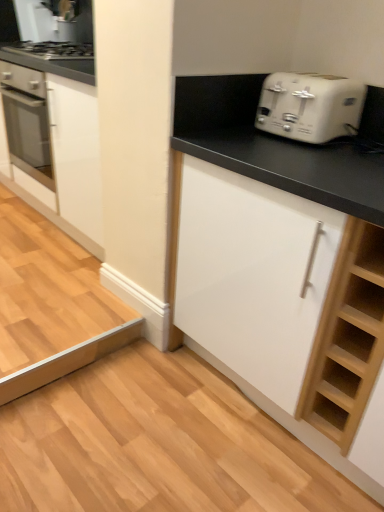
The height and width of the screenshot is (512, 384). I want to click on white glossy cabinet at left, which is the second cabinetry in front-to-back order, so click(x=59, y=144).

How much space does white matte cabinet at center, which ranks as the first cabinetry in front-to-back order, occupy vertically?

white matte cabinet at center, which ranks as the first cabinetry in front-to-back order, is 36.40 inches tall.

This screenshot has height=512, width=384. In order to click on white glossy cabinet at left, which is the first cabinetry from left to right in this screenshot , I will do `click(59, 144)`.

From the image's perspective, would you say white plastic toaster at upper right is shown under white matte cabinet at center, arranged as the 2th cabinetry when viewed from the left?

Incorrect, from the image's perspective, white plastic toaster at upper right is higher than white matte cabinet at center, arranged as the 2th cabinetry when viewed from the left.

Considering the relative positions of white plastic toaster at upper right and white matte cabinet at center, which ranks as the first cabinetry in front-to-back order, in the image provided, is white plastic toaster at upper right to the left of white matte cabinet at center, which ranks as the first cabinetry in front-to-back order, from the viewer's perspective?

Correct, you'll find white plastic toaster at upper right to the left of white matte cabinet at center, which ranks as the first cabinetry in front-to-back order.

Is white plastic toaster at upper right in front of or behind white matte cabinet at center, acting as the second cabinetry starting from the back, in the image?

Clearly, white plastic toaster at upper right is behind white matte cabinet at center, acting as the second cabinetry starting from the back.

Could you tell me if white plastic toaster at upper right is turned towards white matte cabinet at center, arranged as the 2th cabinetry when viewed from the left?

No, white plastic toaster at upper right is not turned towards white matte cabinet at center, arranged as the 2th cabinetry when viewed from the left.

From the picture: From the image's perspective, is white glossy cabinet at left, the 1th cabinetry from the back, located above or below white matte cabinet at center, which ranks as the first cabinetry in front-to-back order?

Clearly, from the image's perspective, white glossy cabinet at left, the 1th cabinetry from the back, is above white matte cabinet at center, which ranks as the first cabinetry in front-to-back order.

Locate an element on the screen. The height and width of the screenshot is (512, 384). cabinetry below the white glossy cabinet at left, acting as the 2th cabinetry starting from the right (from a real-world perspective) is located at coordinates (267, 183).

Is white glossy cabinet at left, acting as the 2th cabinetry starting from the right, inside the boundaries of white matte cabinet at center, which ranks as the first cabinetry in front-to-back order, or outside?

white glossy cabinet at left, acting as the 2th cabinetry starting from the right, is not enclosed by white matte cabinet at center, which ranks as the first cabinetry in front-to-back order.

Which of these two, white matte cabinet at center, which ranks as the first cabinetry in front-to-back order, or white plastic toaster at upper right, is thinner?

white plastic toaster at upper right is thinner.

Can you confirm if white matte cabinet at center, acting as the second cabinetry starting from the back, is shorter than white plastic toaster at upper right?

No.

Which is more to the right, white matte cabinet at center, which ranks as the first cabinetry in front-to-back order, or white plastic toaster at upper right?

white matte cabinet at center, which ranks as the first cabinetry in front-to-back order, is more to the right.

From a real-world perspective, is white matte cabinet at center, acting as the second cabinetry starting from the back, physically below white plastic toaster at upper right?

Yes, from a real-world perspective, white matte cabinet at center, acting as the second cabinetry starting from the back, is below white plastic toaster at upper right.

Based on the photo, visually, is white plastic toaster at upper right positioned to the left or to the right of white glossy cabinet at left, which is the first cabinetry from left to right?

In the image, white plastic toaster at upper right appears on the right side of white glossy cabinet at left, which is the first cabinetry from left to right.

Is point (332, 135) positioned before point (5, 47)?

Yes, it is in front of point (5, 47).

In the scene shown: From the image's perspective, is white plastic toaster at upper right on white glossy cabinet at left, which is the first cabinetry from left to right?

No, from the image's perspective, white plastic toaster at upper right is not over white glossy cabinet at left, which is the first cabinetry from left to right.

Choose the correct answer: Is white plastic toaster at upper right inside white glossy cabinet at left, which is the first cabinetry from left to right, or outside it?

The correct answer is: outside.

Is white matte cabinet at center, which appears as the 1th cabinetry when viewed from the right, placed right next to white glossy cabinet at left, acting as the 2th cabinetry starting from the right?

No.

Between white matte cabinet at center, which ranks as the first cabinetry in front-to-back order, and white glossy cabinet at left, which is the second cabinetry in front-to-back order, which one appears on the left side from the viewer's perspective?

white glossy cabinet at left, which is the second cabinetry in front-to-back order, is more to the left.

Is white matte cabinet at center, arranged as the 2th cabinetry when viewed from the left, taller than white glossy cabinet at left, acting as the 2th cabinetry starting from the right?

Indeed, white matte cabinet at center, arranged as the 2th cabinetry when viewed from the left, has a greater height compared to white glossy cabinet at left, acting as the 2th cabinetry starting from the right.

Who is taller, white glossy cabinet at left, acting as the 2th cabinetry starting from the right, or white plastic toaster at upper right?

white glossy cabinet at left, acting as the 2th cabinetry starting from the right.

Would you say white glossy cabinet at left, acting as the 2th cabinetry starting from the right, contains white plastic toaster at upper right?

No, white plastic toaster at upper right is not surrounded by white glossy cabinet at left, acting as the 2th cabinetry starting from the right.

In the scene shown: Which object is positioned more to the left, white glossy cabinet at left, acting as the 2th cabinetry starting from the right, or white plastic toaster at upper right?

white glossy cabinet at left, acting as the 2th cabinetry starting from the right.

Which is in front, white glossy cabinet at left, which is the second cabinetry in front-to-back order, or white plastic toaster at upper right?

white plastic toaster at upper right is closer to the camera.

Where is `toaster above the white matte cabinet at center, arranged as the 2th cabinetry when viewed from the left (from the image's perspective)`? Image resolution: width=384 pixels, height=512 pixels. toaster above the white matte cabinet at center, arranged as the 2th cabinetry when viewed from the left (from the image's perspective) is located at coordinates (310, 106).

Where is `cabinetry lying below the white glossy cabinet at left, which is the second cabinetry in front-to-back order (from the image's perspective)`? This screenshot has height=512, width=384. cabinetry lying below the white glossy cabinet at left, which is the second cabinetry in front-to-back order (from the image's perspective) is located at coordinates (267, 183).

Considering their positions, is white plastic toaster at upper right positioned closer to white matte cabinet at center, acting as the second cabinetry starting from the back, than white glossy cabinet at left, which is the second cabinetry in front-to-back order?

Based on the image, white plastic toaster at upper right appears to be nearer to white matte cabinet at center, acting as the second cabinetry starting from the back.

Looking at the image, which one is located closer to white matte cabinet at center, which appears as the 1th cabinetry when viewed from the right, white glossy cabinet at left, which is the second cabinetry in front-to-back order, or white plastic toaster at upper right?

white plastic toaster at upper right is positioned closer to the anchor white matte cabinet at center, which appears as the 1th cabinetry when viewed from the right.

From the image, which object appears to be farther from white plastic toaster at upper right, white matte cabinet at center, which appears as the 1th cabinetry when viewed from the right, or white glossy cabinet at left, acting as the 2th cabinetry starting from the right?

white glossy cabinet at left, acting as the 2th cabinetry starting from the right.

From the image, which object appears to be farther from white plastic toaster at upper right, white glossy cabinet at left, which is the first cabinetry from left to right, or white matte cabinet at center, arranged as the 2th cabinetry when viewed from the left?

The object further to white plastic toaster at upper right is white glossy cabinet at left, which is the first cabinetry from left to right.

Estimate the real-world distances between objects in this image. Which object is closer to white glossy cabinet at left, which is the first cabinetry from left to right, white plastic toaster at upper right or white matte cabinet at center, acting as the second cabinetry starting from the back?

Based on the image, white matte cabinet at center, acting as the second cabinetry starting from the back, appears to be nearer to white glossy cabinet at left, which is the first cabinetry from left to right.

Consider the image. From the image, which object appears to be farther from white glossy cabinet at left, which is the first cabinetry from left to right, white matte cabinet at center, arranged as the 2th cabinetry when viewed from the left, or white plastic toaster at upper right?

Among the two, white plastic toaster at upper right is located further to white glossy cabinet at left, which is the first cabinetry from left to right.

This screenshot has height=512, width=384. Identify the location of toaster situated between white glossy cabinet at left, acting as the 2th cabinetry starting from the right, and white matte cabinet at center, which ranks as the first cabinetry in front-to-back order, from left to right. [310, 106].